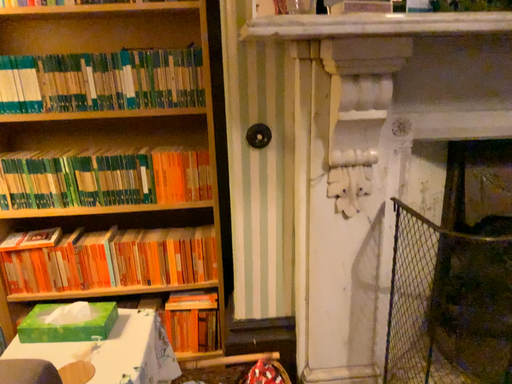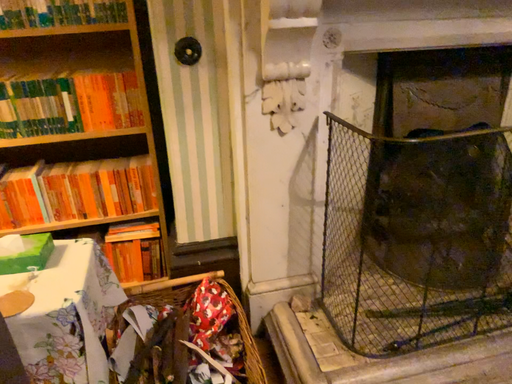
Question: How did the camera likely rotate when shooting the video?

Choices:
 (A) rotated upward
 (B) rotated downward

Answer: (B)